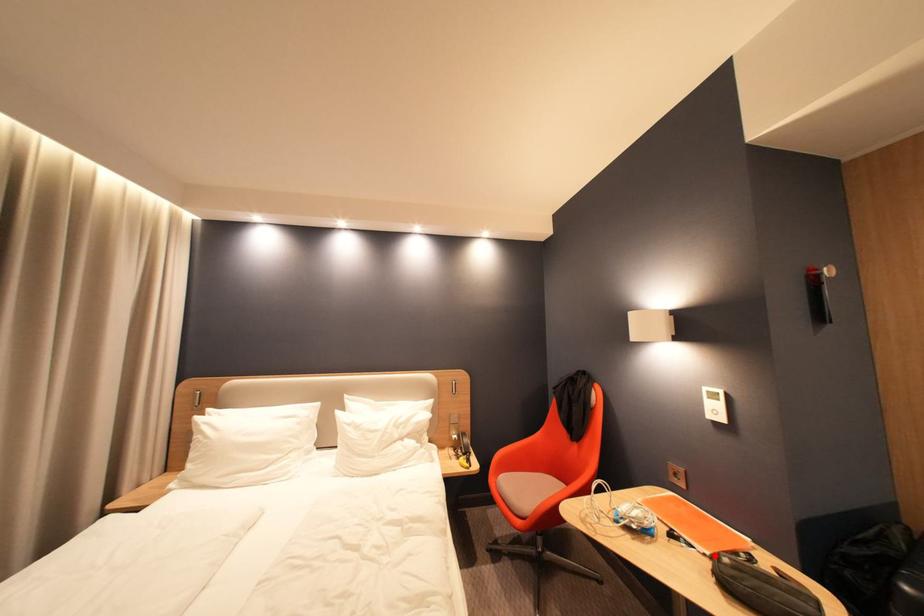
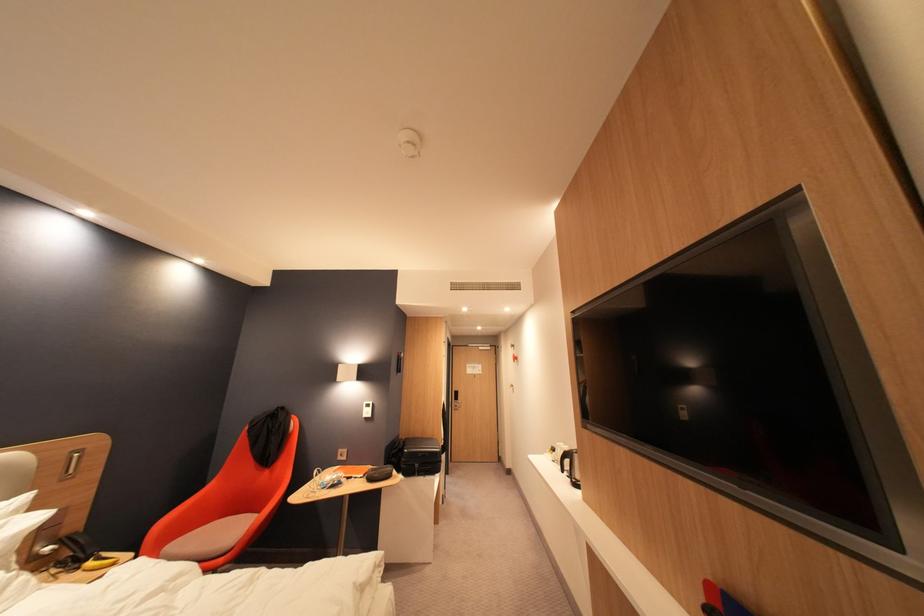
The point at the highlighted location is marked in the first image. Where is the corresponding point in the second image?

(371, 477)